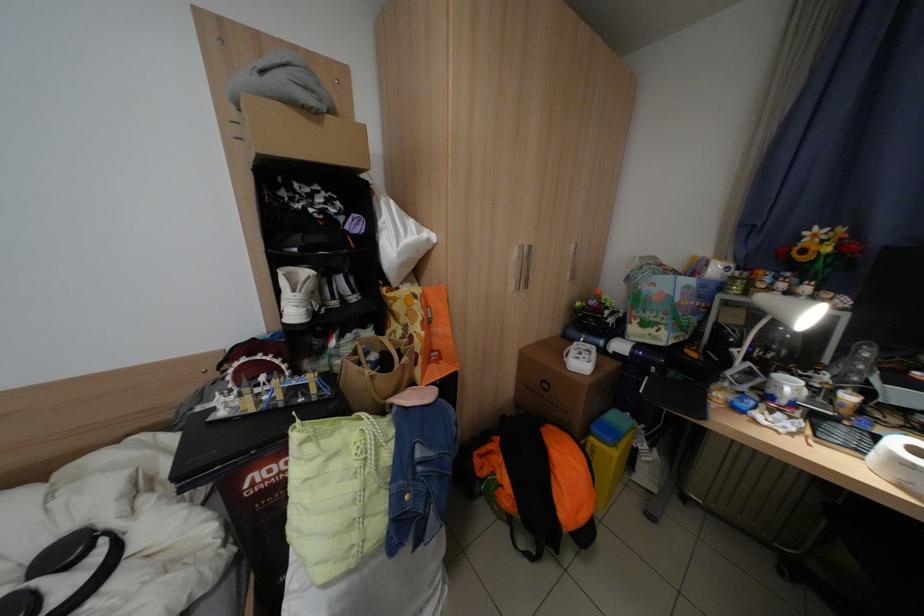
Where would you lift the roll of paper towels? Please return your answer as a coordinate pair (x, y).

(898, 463)